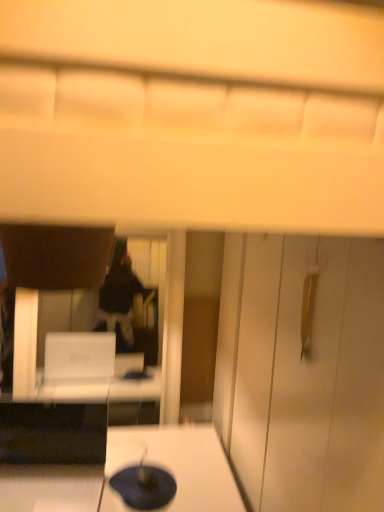
Image resolution: width=384 pixels, height=512 pixels. In order to click on white glossy cabinet at center in this screenshot , I will do `click(303, 371)`.

Describe the element at coordinates (303, 371) in the screenshot. Image resolution: width=384 pixels, height=512 pixels. I see `white glossy cabinet at center` at that location.

Locate an element on the screen. This screenshot has height=512, width=384. white glossy cabinet at center is located at coordinates (303, 371).